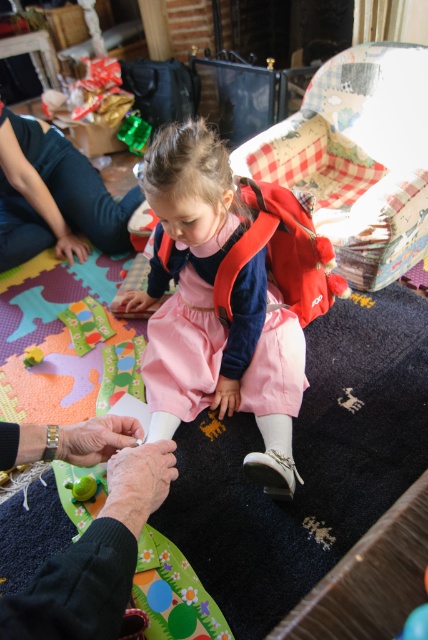
You are organizing a playdate and need to arrange two items in a room. The pink satin dress at center and the dark green fabric at upper left. Which item takes up more space?

The pink satin dress at center has a larger size compared to dark green fabric at upper left, so the pink satin dress at center takes up more space.

You are a photographer trying to capture a closeup of the pink satin dress at center and the green matte toy at lower left. Which object should you focus on first to ensure it appears sharp in the photo?

The pink satin dress at center should be focused on first since it is closer to the viewer than the green matte toy at lower left, ensuring it will be sharp while the background object may be slightly blurred.